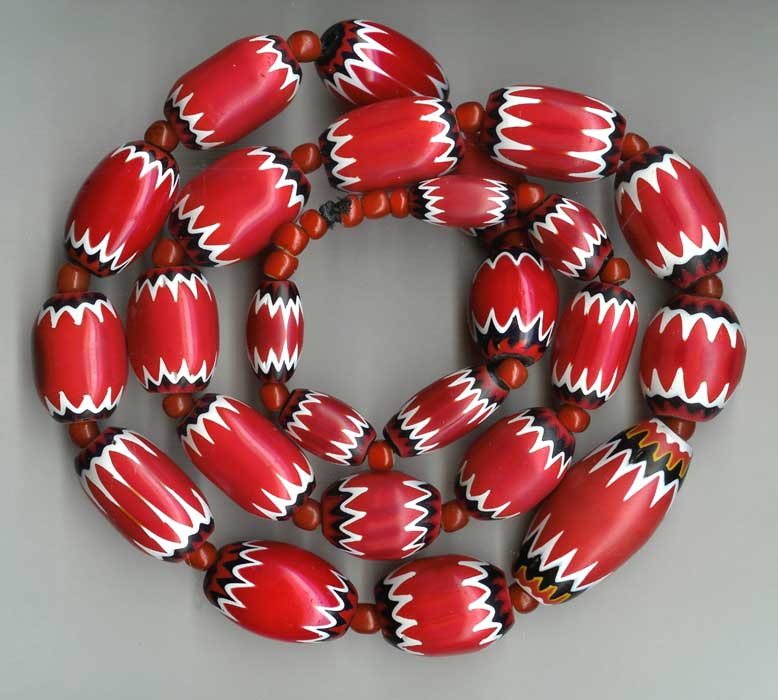
I want to click on white paint, so click(x=344, y=164).